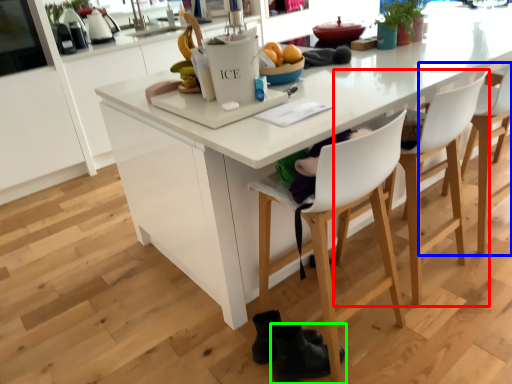
Question: Based on their relative distances, which object is nearer to chair (highlighted by a red box)? Choose from chair (highlighted by a blue box) and footwear (highlighted by a green box).

Choices:
 (A) chair
 (B) footwear

Answer: (A)